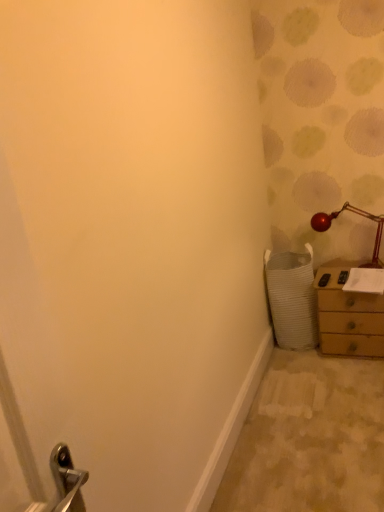
Question: Considering their positions, is metallic red lamp at upper right located in front of or behind wooden chest of drawers at right?

Choices:
 (A) behind
 (B) front

Answer: (A)

Question: From the image's perspective, is metallic red lamp at upper right positioned above or below wooden chest of drawers at right?

Choices:
 (A) below
 (B) above

Answer: (B)

Question: Based on their positions, is metallic red lamp at upper right located to the left or right of wooden chest of drawers at right?

Choices:
 (A) right
 (B) left

Answer: (B)

Question: Is wooden chest of drawers at right wider or thinner than metallic red lamp at upper right?

Choices:
 (A) wide
 (B) thin

Answer: (A)

Question: In terms of height, does wooden chest of drawers at right look taller or shorter compared to metallic red lamp at upper right?

Choices:
 (A) tall
 (B) short

Answer: (A)

Question: Relative to metallic red lamp at upper right, is wooden chest of drawers at right in front or behind?

Choices:
 (A) behind
 (B) front

Answer: (B)

Question: Is wooden chest of drawers at right inside the boundaries of metallic red lamp at upper right, or outside?

Choices:
 (A) outside
 (B) inside

Answer: (A)